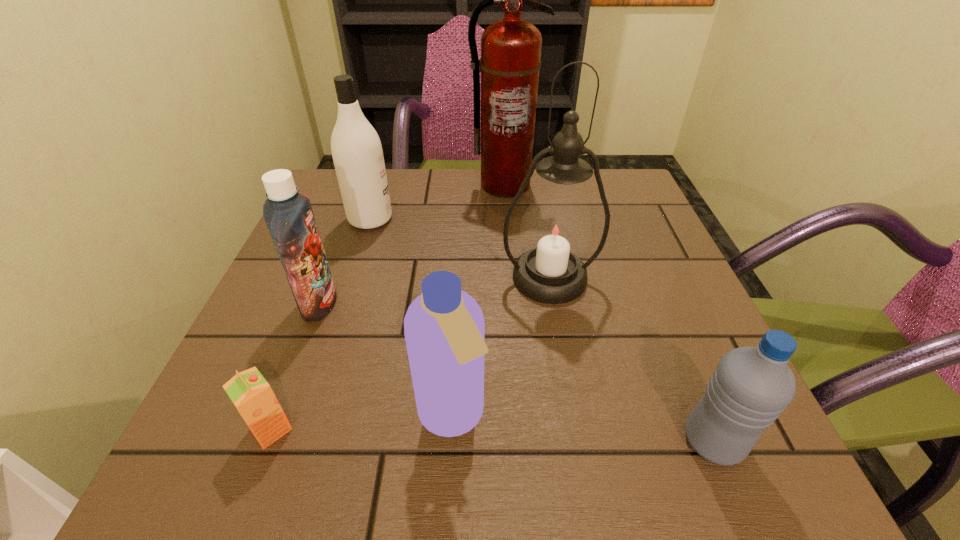
Where is `orange juice positioned at the near edge`? orange juice positioned at the near edge is located at coordinates (251, 394).

Find the location of a particular element. This screenshot has height=540, width=960. orange juice located in the left edge section of the desktop is located at coordinates (251, 394).

The width and height of the screenshot is (960, 540). I want to click on object that is at the right edge, so click(x=751, y=386).

In order to click on object located in the far left corner section of the desktop in this screenshot , I will do `click(357, 152)`.

Image resolution: width=960 pixels, height=540 pixels. I want to click on object located in the near left corner section of the desktop, so click(x=251, y=394).

At what (x,y) coordinates should I click in order to perform the action: click on object located at the near right corner. Please return your answer as a coordinate pair (x, y). Image resolution: width=960 pixels, height=540 pixels. Looking at the image, I should click on (751, 386).

Identify the location of vacant space at the far edge of the desktop. The image size is (960, 540). (395, 175).

Find the location of a particular element. This screenshot has height=540, width=960. free space at the near edge is located at coordinates (371, 479).

This screenshot has width=960, height=540. In order to click on vacant space at the left edge in this screenshot , I will do `click(350, 245)`.

Identify the location of vacant space at the right edge of the desktop. (685, 326).